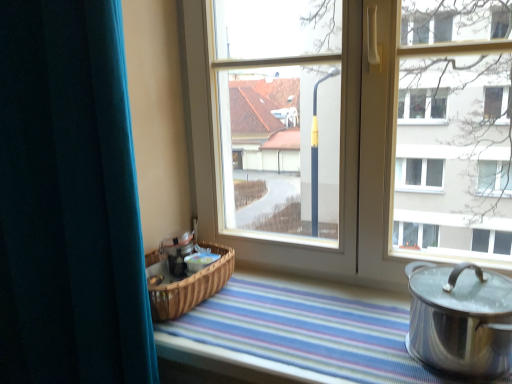
Locate an element on the screen. transparent glass window at center is located at coordinates (340, 156).

Where is `transparent glass window at center`? This screenshot has width=512, height=384. transparent glass window at center is located at coordinates (340, 156).

Which of these two, polished silver pot at lower right or teal velvet curtain at left, is smaller?

polished silver pot at lower right.

Based on the photo, are polished silver pot at lower right and teal velvet curtain at left making contact?

No, polished silver pot at lower right is not in contact with teal velvet curtain at left.

Choose the correct answer: Is polished silver pot at lower right inside teal velvet curtain at left or outside it?

polished silver pot at lower right is not enclosed by teal velvet curtain at left.

Choose the correct answer: Is polished silver pot at lower right inside transparent glass window at center or outside it?

polished silver pot at lower right lies outside transparent glass window at center.

Which is nearer, (470, 315) or (348, 97)?

Point (470, 315).

Is polished silver pot at lower right oriented away from transparent glass window at center?

Yes, polished silver pot at lower right is facing away from transparent glass window at center.

From a real-world perspective, is teal velvet curtain at left physically located above or below polished silver pot at lower right?

In terms of real-world spatial position, teal velvet curtain at left is above polished silver pot at lower right.

Is teal velvet curtain at left far from polished silver pot at lower right?

No, there isn't a large distance between teal velvet curtain at left and polished silver pot at lower right.

From the image's perspective, is teal velvet curtain at left positioned above or below polished silver pot at lower right?

Clearly, from the image's perspective, teal velvet curtain at left is above polished silver pot at lower right.

Considering the points (94, 61) and (377, 226), which point is behind, point (94, 61) or point (377, 226)?

Point (377, 226)

Is teal velvet curtain at left facing away from transparent glass window at center?

No, teal velvet curtain at left's orientation is not away from transparent glass window at center.

Is teal velvet curtain at left wider than transparent glass window at center?

Correct, the width of teal velvet curtain at left exceeds that of transparent glass window at center.

Is teal velvet curtain at left smaller than transparent glass window at center?

Actually, teal velvet curtain at left might be larger than transparent glass window at center.

Is polished silver pot at lower right a part of transparent glass window at center?

No.

The width and height of the screenshot is (512, 384). I want to click on crock pot on the right of transparent glass window at center, so click(x=460, y=319).

Is transparent glass window at center turned away from polished silver pot at lower right?

No, transparent glass window at center is not facing away from polished silver pot at lower right.

Who is bigger, transparent glass window at center or polished silver pot at lower right?

transparent glass window at center is bigger.

Considering the relative sizes of transparent glass window at center and teal velvet curtain at left in the image provided, is transparent glass window at center thinner than teal velvet curtain at left?

Correct, the width of transparent glass window at center is less than that of teal velvet curtain at left.

Based on the photo, is teal velvet curtain at left completely or partially inside transparent glass window at center?

No, teal velvet curtain at left is not inside transparent glass window at center.

Which object is positioned more to the right, transparent glass window at center or teal velvet curtain at left?

Positioned to the right is transparent glass window at center.

Identify the location of curtain on the left of polished silver pot at lower right. (69, 200).

Locate an element on the screen. This screenshot has height=384, width=512. crock pot lying on the right of transparent glass window at center is located at coordinates (460, 319).

Which object lies further to the anchor point transparent glass window at center, polished silver pot at lower right or teal velvet curtain at left?

The object further to transparent glass window at center is teal velvet curtain at left.

When comparing their distances from polished silver pot at lower right, does transparent glass window at center or teal velvet curtain at left seem closer?

The object closer to polished silver pot at lower right is transparent glass window at center.

Considering their positions, is polished silver pot at lower right positioned closer to teal velvet curtain at left than transparent glass window at center?

transparent glass window at center lies closer to teal velvet curtain at left than the other object.

Looking at this image, from the image, which object appears to be nearer to teal velvet curtain at left, transparent glass window at center or polished silver pot at lower right?

The object closer to teal velvet curtain at left is transparent glass window at center.

From the image, which object appears to be farther from transparent glass window at center, teal velvet curtain at left or polished silver pot at lower right?

teal velvet curtain at left lies further to transparent glass window at center than the other object.

Based on the photo, when comparing their distances from polished silver pot at lower right, does teal velvet curtain at left or transparent glass window at center seem closer?

Based on the image, transparent glass window at center appears to be nearer to polished silver pot at lower right.

The image size is (512, 384). In order to click on window between teal velvet curtain at left and polished silver pot at lower right in this screenshot , I will do `click(340, 156)`.